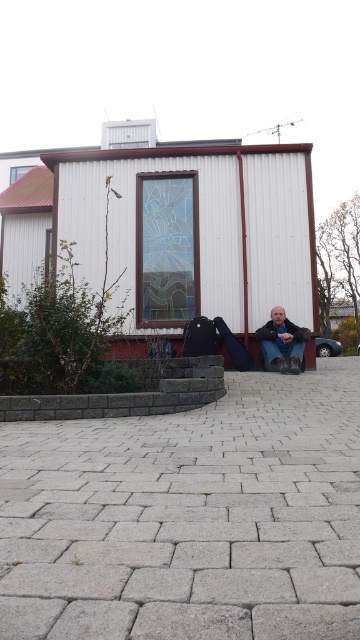
Question: Does gray concrete pavement at center appear under matte black boots at lower center?

Choices:
 (A) yes
 (B) no

Answer: (A)

Question: Can you confirm if gray concrete pavement at center is positioned to the left of matte black boots at lower center?

Choices:
 (A) yes
 (B) no

Answer: (A)

Question: Among these points, which one is nearest to the camera?

Choices:
 (A) (262, 332)
 (B) (6, 492)

Answer: (B)

Question: Which point is closer to the camera?

Choices:
 (A) gray concrete pavement at center
 (B) matte black boots at lower center

Answer: (A)

Question: Can you confirm if gray concrete pavement at center is thinner than matte black boots at lower center?

Choices:
 (A) no
 (B) yes

Answer: (A)

Question: Which object is farther from the camera taking this photo?

Choices:
 (A) matte black boots at lower center
 (B) gray concrete pavement at center

Answer: (A)